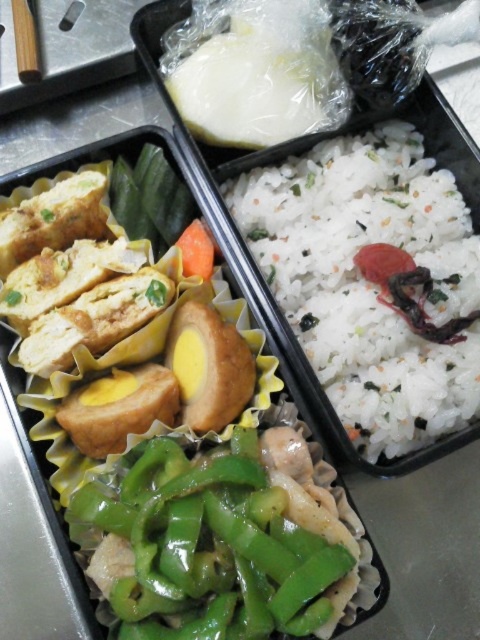
Question: Which point appears closest to the camera in this image?

Choices:
 (A) (287, 225)
 (B) (283, 586)

Answer: (B)

Question: Does white matte rice at center have a greater width compared to green glossy bell pepper at center?

Choices:
 (A) no
 (B) yes

Answer: (B)

Question: Is white matte rice at center smaller than green glossy bell pepper at center?

Choices:
 (A) no
 (B) yes

Answer: (A)

Question: Which of the following is the closest to the observer?

Choices:
 (A) click(348, 291)
 (B) click(266, 563)

Answer: (B)

Question: Which object appears farthest from the camera in this image?

Choices:
 (A) white matte rice at center
 (B) green glossy bell pepper at center

Answer: (A)

Question: Is white matte rice at center wider than green glossy bell pepper at center?

Choices:
 (A) yes
 (B) no

Answer: (A)